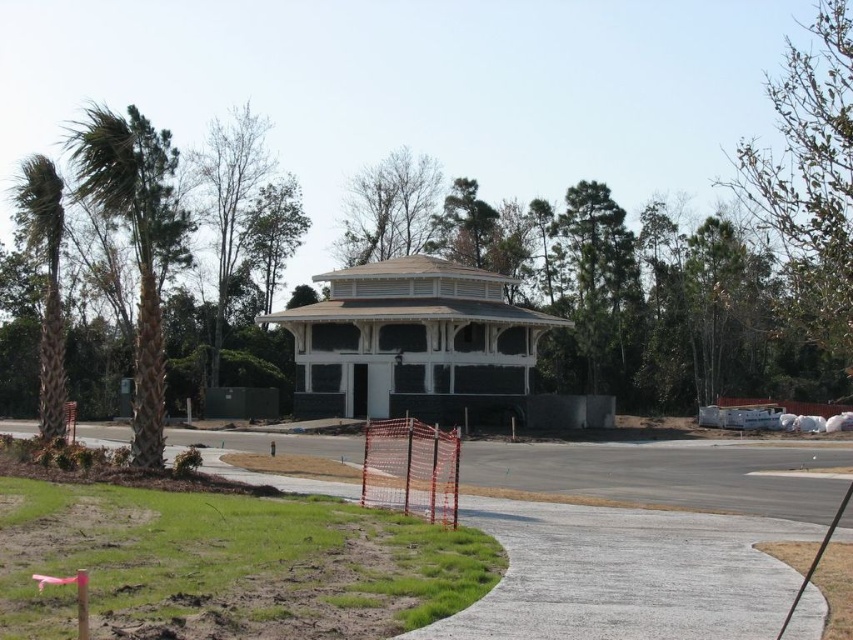
Question: Which of these objects is positioned farthest from the white wood gazebo at center?

Choices:
 (A) green textured palm tree at left
 (B) gray concrete pavement at center
 (C) green leafy palm tree at left
 (D) bare branches at upper right

Answer: (D)

Question: In this image, where is bare branches at upper right located relative to green textured palm tree at left?

Choices:
 (A) above
 (B) below

Answer: (A)

Question: Which point is farther to the camera?

Choices:
 (A) gray concrete pavement at center
 (B) green textured palm tree at left

Answer: (B)

Question: Which point is farther from the camera taking this photo?

Choices:
 (A) 845,273
 (B) 115,115
 (C) 459,376

Answer: (B)

Question: Is gray concrete pavement at center wider than green textured palm tree at left?

Choices:
 (A) no
 (B) yes

Answer: (A)

Question: Does gray concrete pavement at center appear on the right side of green leafy palm tree at left?

Choices:
 (A) yes
 (B) no

Answer: (A)